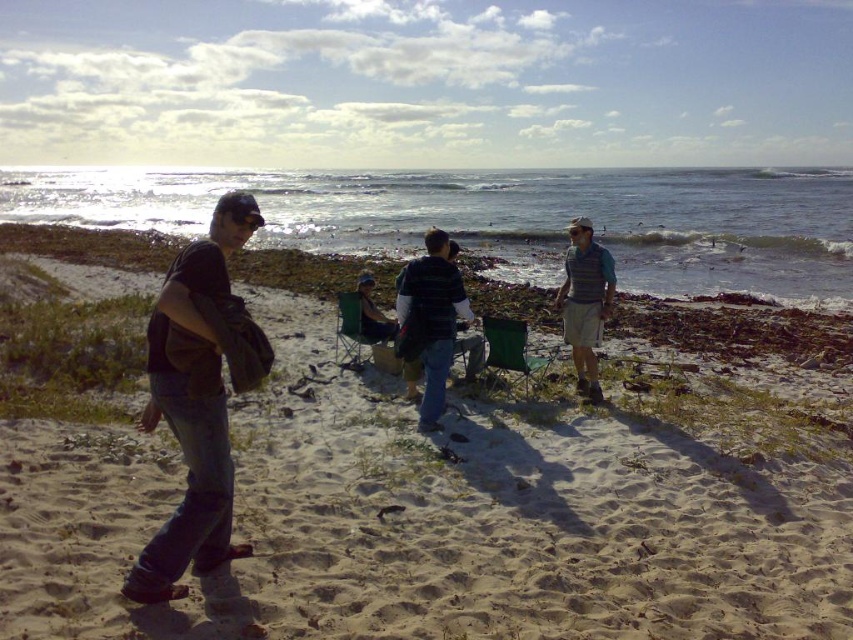
Question: Considering the real-world distances, which object is closest to the gray knit vest at right?

Choices:
 (A) striped sweater at center
 (B) dark brown leather jacket at left

Answer: (A)

Question: Does striped sweater at center appear over gray knit vest at right?

Choices:
 (A) yes
 (B) no

Answer: (B)

Question: Which of the following is the farthest from the observer?

Choices:
 (A) dark brown leather jacket at left
 (B) striped sweater at center
 (C) gray knit vest at right

Answer: (C)

Question: Is dark brown leather jacket at left closer to camera compared to gray knit vest at right?

Choices:
 (A) yes
 (B) no

Answer: (A)

Question: Considering the real-world distances, which object is closest to the striped sweater at center?

Choices:
 (A) sandy beach at center
 (B) clear blue water at upper center
 (C) dark brown leather jacket at left

Answer: (C)

Question: Considering the relative positions of dark brown leather jacket at left and striped sweater at center in the image provided, where is dark brown leather jacket at left located with respect to striped sweater at center?

Choices:
 (A) right
 (B) left

Answer: (B)